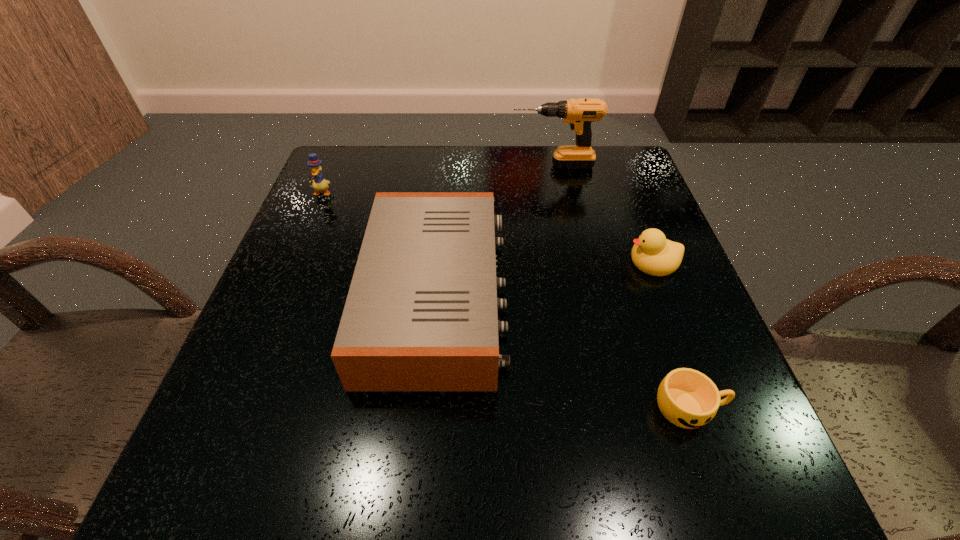
In order to click on the tallest object in this screenshot , I will do (579, 113).

Locate an element on the screen. This screenshot has height=540, width=960. the farthest object is located at coordinates (579, 113).

Find the location of a particular element. The width and height of the screenshot is (960, 540). the second farthest object is located at coordinates (319, 183).

Find the location of `the leftmost object`. the leftmost object is located at coordinates (319, 183).

Where is `radio receiver`? radio receiver is located at coordinates (421, 314).

The image size is (960, 540). In order to click on the shorter duckling in this screenshot , I will do `click(653, 254)`.

Locate an element on the screen. the second shortest object is located at coordinates click(x=653, y=254).

The image size is (960, 540). In order to click on cup in this screenshot , I will do `click(687, 398)`.

Locate an element on the screen. Image resolution: width=960 pixels, height=540 pixels. vacant position located 0.250m at the tip of the farthest object is located at coordinates (416, 165).

At what (x,y) coordinates should I click in order to perform the action: click on free spot located 0.140m at the tip of the farthest object. Please return your answer as a coordinate pair (x, y). The height and width of the screenshot is (540, 960). Looking at the image, I should click on (457, 165).